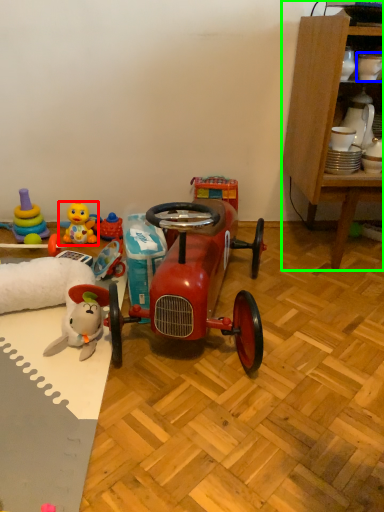
Question: Which object is the farthest from toy (highlighted by a red box)? Choose among these: toy (highlighted by a blue box) or cabinetry (highlighted by a green box).

Choices:
 (A) toy
 (B) cabinetry

Answer: (A)